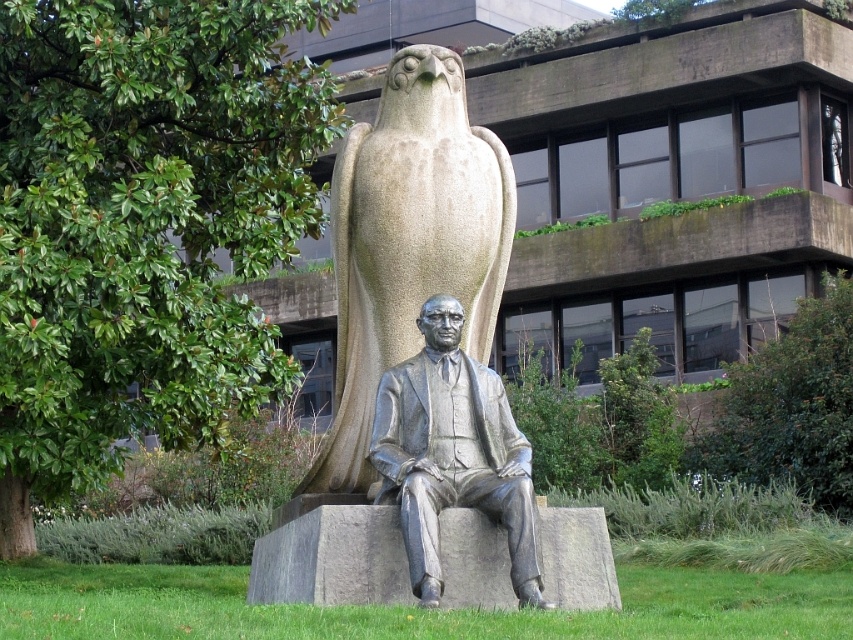
Question: Can you confirm if granite eagle at center is thinner than polished bronze statue at center?

Choices:
 (A) yes
 (B) no

Answer: (B)

Question: Among these objects, which one is nearest to the camera?

Choices:
 (A) polished bronze statue at center
 (B) granite eagle at center

Answer: (A)

Question: Can you confirm if granite eagle at center is bigger than polished bronze statue at center?

Choices:
 (A) yes
 (B) no

Answer: (A)

Question: Which point is farther to the camera?

Choices:
 (A) (447, 68)
 (B) (422, 413)

Answer: (A)

Question: Can you confirm if granite eagle at center is positioned above polished bronze statue at center?

Choices:
 (A) no
 (B) yes

Answer: (B)